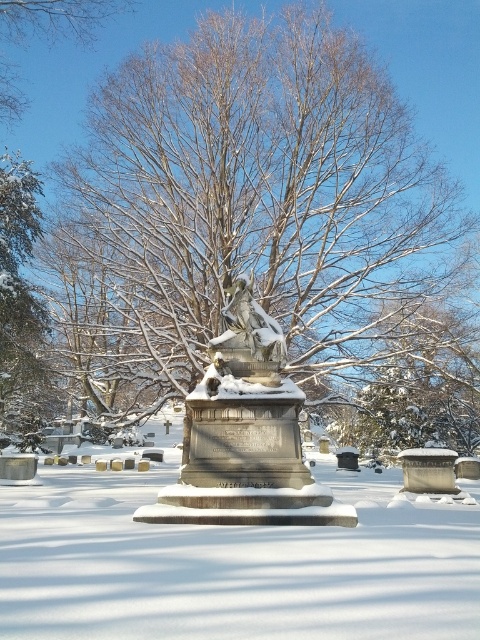
Is green textured evergreen tree at left closer to camera compared to bare branches at upper center?

No, green textured evergreen tree at left is further to the viewer.

Locate an element on the screen. green textured evergreen tree at left is located at coordinates (21, 301).

Does white powdery snow at center appear on the right side of bare branches at upper center?

Yes, white powdery snow at center is to the right of bare branches at upper center.

Is white powdery snow at center shorter than bare branches at upper center?

In fact, white powdery snow at center may be taller than bare branches at upper center.

This screenshot has width=480, height=640. What are the coordinates of `white powdery snow at center` in the screenshot? It's located at (231, 563).

Is snow-covered branches at center bigger than bare branches at upper center?

Correct, snow-covered branches at center is larger in size than bare branches at upper center.

Between point (271, 33) and point (0, 29), which one is positioned behind?

Positioned behind is point (271, 33).

This screenshot has height=640, width=480. What are the coordinates of `snow-covered branches at center` in the screenshot? It's located at (243, 209).